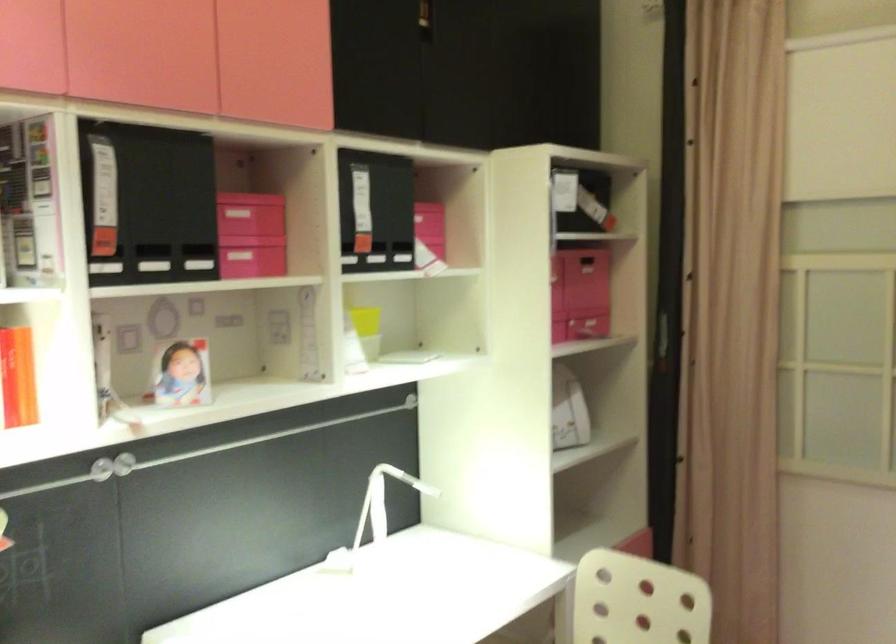
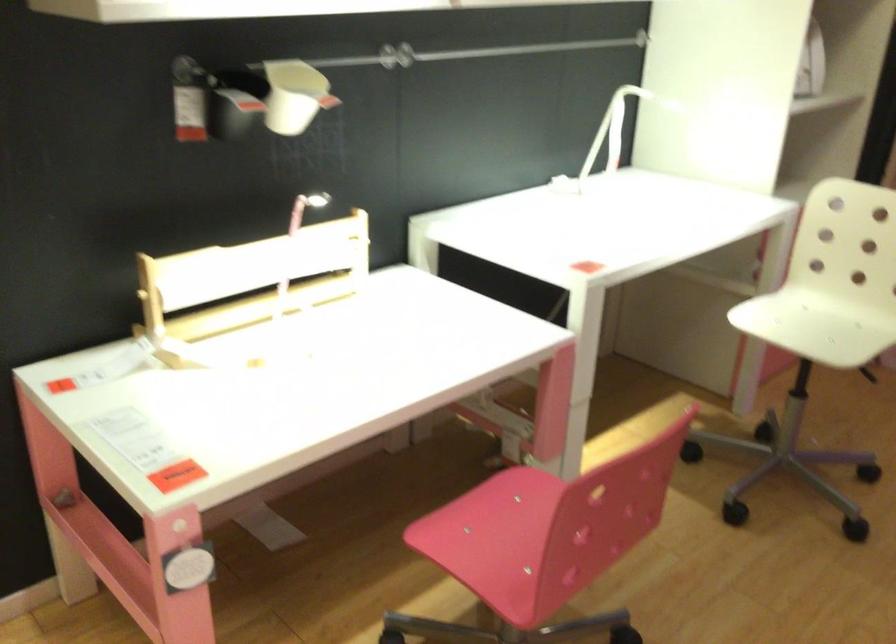
Which direction would the cameraman need to move to produce the second image?

The movement direction of the cameraman is left, backward.